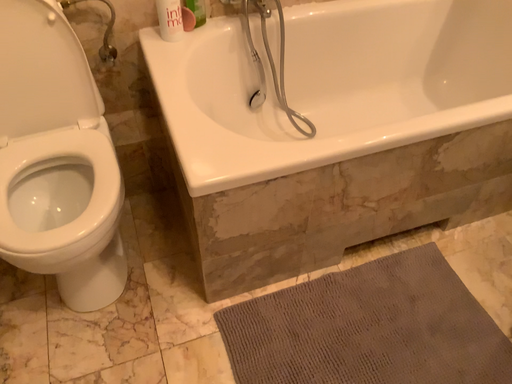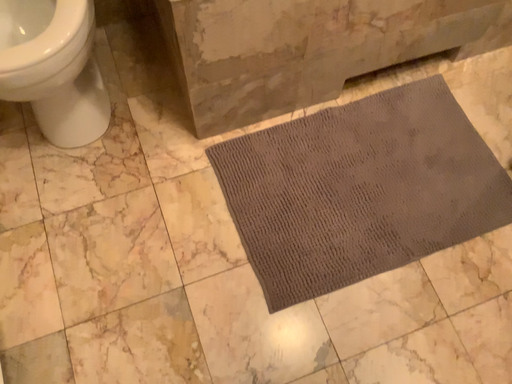
Question: Which way did the camera rotate in the video?

Choices:
 (A) rotated downward
 (B) rotated upward

Answer: (A)